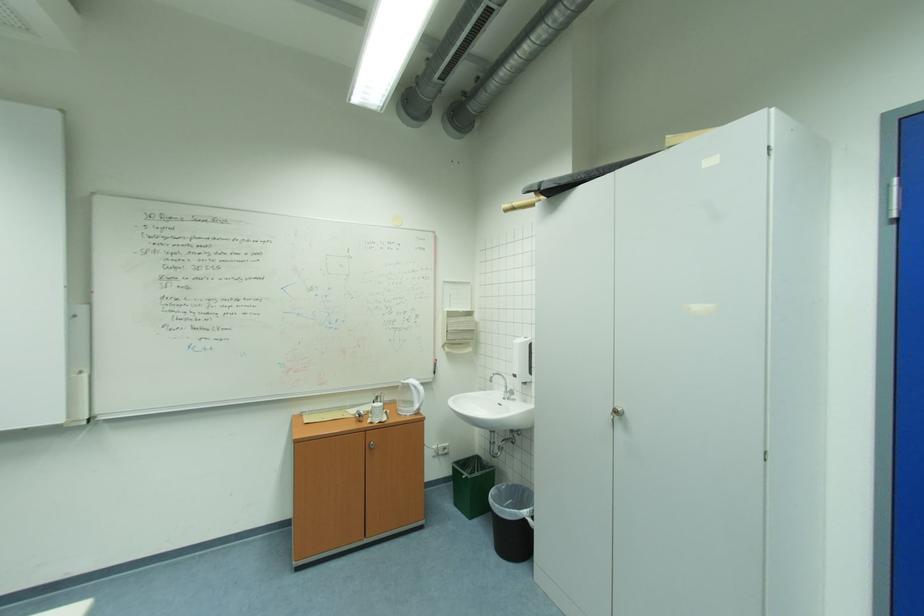
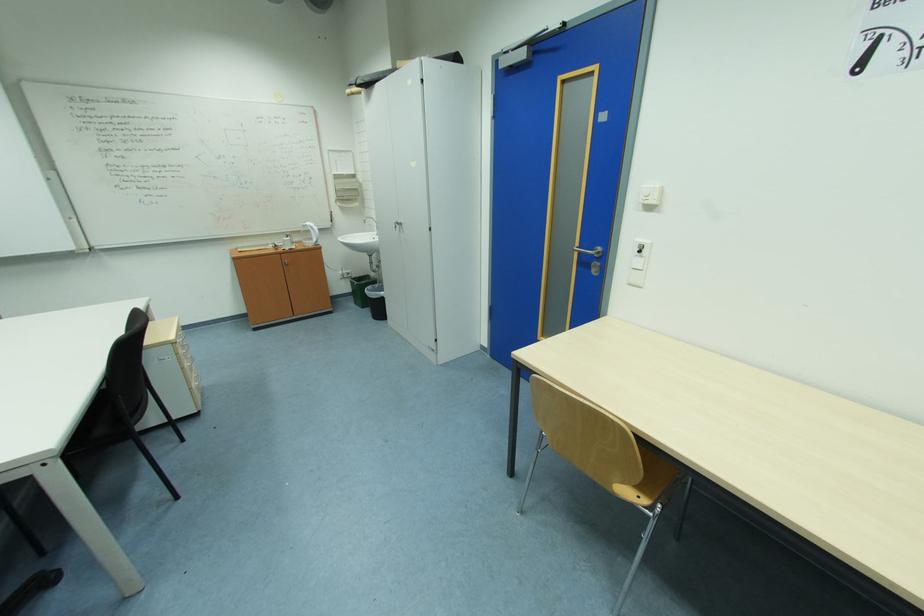
Where in the second image is the point corresponding to (416,384) from the first image?

(313, 225)